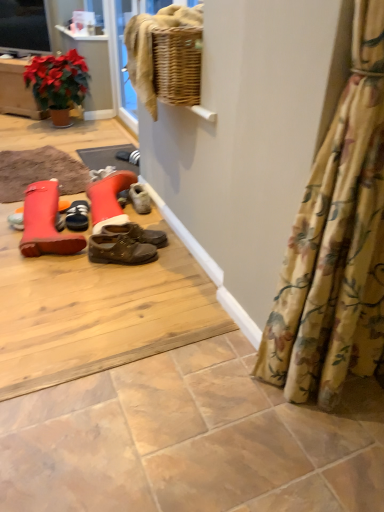
In order to face matte black television at upper left, should I rotate leftwards or rightwards?

Turn left approximately 22.263 degrees to face it.

This screenshot has width=384, height=512. In order to click on leather boot at left, which is the 1th footwear from front to back in this screenshot , I will do `click(45, 223)`.

This screenshot has height=512, width=384. Describe the element at coordinates (337, 243) in the screenshot. I see `floral fabric curtain at lower right` at that location.

What is the approximate height of black suede shoes at center, which is the 1th footwear in back-to-front order?

It is 7.74 centimeters.

Identify the location of matte black television at upper left. (24, 26).

Considering the sizes of leather boot at left, acting as the 2th footwear starting from the back, and black suede shoes at center, acting as the second footwear starting from the front, in the image, is leather boot at left, acting as the 2th footwear starting from the back, wider or thinner than black suede shoes at center, acting as the second footwear starting from the front,?

In the image, leather boot at left, acting as the 2th footwear starting from the back, appears to be wider than black suede shoes at center, acting as the second footwear starting from the front.

Which object is closer to the camera, leather boot at left, acting as the 2th footwear starting from the back, or black suede shoes at center, which is the 1th footwear in back-to-front order?

leather boot at left, acting as the 2th footwear starting from the back, is closer to the camera.

Is leather boot at left, acting as the 2th footwear starting from the back, inside the boundaries of black suede shoes at center, acting as the second footwear starting from the front, or outside?

The correct answer is: outside.

From the image's perspective, relative to black suede shoes at center, acting as the second footwear starting from the front, is leather boot at left, acting as the 2th footwear starting from the back, above or below?

Clearly, from the image's perspective, leather boot at left, acting as the 2th footwear starting from the back, is below black suede shoes at center, acting as the second footwear starting from the front.

Is black suede shoes at center, which is the 1th footwear in back-to-front order, surrounding leather boot at left, which is the 1th footwear from front to back?

That's incorrect, leather boot at left, which is the 1th footwear from front to back, is not inside black suede shoes at center, which is the 1th footwear in back-to-front order.

Is black suede shoes at center, acting as the second footwear starting from the front, bigger or smaller than leather boot at left, which is the 1th footwear from front to back?

In the image, black suede shoes at center, acting as the second footwear starting from the front, appears to be smaller than leather boot at left, which is the 1th footwear from front to back.

Is black suede shoes at center, acting as the second footwear starting from the front, next to leather boot at left, which is the 1th footwear from front to back?

black suede shoes at center, acting as the second footwear starting from the front, is not next to leather boot at left, which is the 1th footwear from front to back, and they're not touching.

Where is `footwear behind the leather boot at left, which is the 1th footwear from front to back`? The height and width of the screenshot is (512, 384). footwear behind the leather boot at left, which is the 1th footwear from front to back is located at coordinates (77, 216).

Which is closer, (25, 14) or (69, 220)?

Positioned in front is point (69, 220).

Who is smaller, matte black television at upper left or black suede shoes at center, acting as the second footwear starting from the front?

black suede shoes at center, acting as the second footwear starting from the front.

Between matte black television at upper left and black suede shoes at center, acting as the second footwear starting from the front, which one is positioned behind?

matte black television at upper left is further from the camera.

From the image's perspective, is matte black television at upper left located above or below black suede shoes at center, which is the 1th footwear in back-to-front order?

Clearly, from the image's perspective, matte black television at upper left is above black suede shoes at center, which is the 1th footwear in back-to-front order.

From a real-world perspective, which is physically above, leather boot at left, which is the 1th footwear from front to back, or matte black television at upper left?

matte black television at upper left.

Is leather boot at left, acting as the 2th footwear starting from the back, oriented away from matte black television at upper left?

That's not correct — leather boot at left, acting as the 2th footwear starting from the back, is not looking away from matte black television at upper left.

Based on their sizes in the image, would you say leather boot at left, which is the 1th footwear from front to back, is bigger or smaller than matte black television at upper left?

A: In the image, leather boot at left, which is the 1th footwear from front to back, appears to be smaller than matte black television at upper left.

Between point (57, 194) and point (284, 353), which one is positioned in front?

Point (284, 353)

In terms of width, does leather boot at left, which is the 1th footwear from front to back, look wider or thinner when compared to floral fabric curtain at lower right?

leather boot at left, which is the 1th footwear from front to back, is wider than floral fabric curtain at lower right.

Does leather boot at left, acting as the 2th footwear starting from the back, come in front of floral fabric curtain at lower right?

No.

From the image's perspective, is leather boot at left, acting as the 2th footwear starting from the back, located beneath floral fabric curtain at lower right?

Actually, leather boot at left, acting as the 2th footwear starting from the back, appears above floral fabric curtain at lower right in the image.

Does floral fabric curtain at lower right have a smaller size compared to matte black television at upper left?

Incorrect, floral fabric curtain at lower right is not smaller in size than matte black television at upper left.

Is point (334, 370) closer to viewer compared to point (38, 38)?

Yes, point (334, 370) is in front of point (38, 38).

In terms of width, does floral fabric curtain at lower right look wider or thinner when compared to matte black television at upper left?

In the image, floral fabric curtain at lower right appears to be wider than matte black television at upper left.

Does floral fabric curtain at lower right touch matte black television at upper left?

floral fabric curtain at lower right and matte black television at upper left are not in contact.

Considering the points (67, 217) and (12, 10), which point is behind, point (67, 217) or point (12, 10)?

The point (12, 10) is more distant.

In terms of height, does black suede shoes at center, acting as the second footwear starting from the front, look taller or shorter compared to matte black television at upper left?

black suede shoes at center, acting as the second footwear starting from the front, is shorter than matte black television at upper left.

How many degrees apart are the facing directions of black suede shoes at center, which is the 1th footwear in back-to-front order, and matte black television at upper left?

The angular difference between black suede shoes at center, which is the 1th footwear in back-to-front order, and matte black television at upper left is 56.9 degrees.

Is black suede shoes at center, which is the 1th footwear in back-to-front order, located outside matte black television at upper left?

black suede shoes at center, which is the 1th footwear in back-to-front order, lies outside matte black television at upper left's area.

Locate an element on the screen. Image resolution: width=384 pixels, height=512 pixels. footwear above the leather boot at left, acting as the 2th footwear starting from the back (from the image's perspective) is located at coordinates (77, 216).

The height and width of the screenshot is (512, 384). I want to click on footwear on the right of leather boot at left, acting as the 2th footwear starting from the back, so click(77, 216).

Looking at the image, which one is located further to matte black television at upper left, black suede shoes at center, which is the 1th footwear in back-to-front order, or floral fabric curtain at lower right?

floral fabric curtain at lower right lies further to matte black television at upper left than the other object.

Based on the photo, estimate the real-world distances between objects in this image. Which object is further from black suede shoes at center, which is the 1th footwear in back-to-front order, floral fabric curtain at lower right or leather boot at left, acting as the 2th footwear starting from the back?

floral fabric curtain at lower right lies further to black suede shoes at center, which is the 1th footwear in back-to-front order, than the other object.

Looking at the image, which one is located further to matte black television at upper left, leather boot at left, acting as the 2th footwear starting from the back, or black suede shoes at center, acting as the second footwear starting from the front?

leather boot at left, acting as the 2th footwear starting from the back, lies further to matte black television at upper left than the other object.

From the image, which object appears to be nearer to floral fabric curtain at lower right, black suede shoes at center, acting as the second footwear starting from the front, or matte black television at upper left?

black suede shoes at center, acting as the second footwear starting from the front, lies closer to floral fabric curtain at lower right than the other object.

Looking at the image, which one is located further to black suede shoes at center, acting as the second footwear starting from the front, leather boot at left, acting as the 2th footwear starting from the back, or floral fabric curtain at lower right?

Based on the image, floral fabric curtain at lower right appears to be further to black suede shoes at center, acting as the second footwear starting from the front.

Based on their spatial positions, is matte black television at upper left or floral fabric curtain at lower right closer to black suede shoes at center, acting as the second footwear starting from the front?

Based on the image, floral fabric curtain at lower right appears to be nearer to black suede shoes at center, acting as the second footwear starting from the front.

Based on their spatial positions, is black suede shoes at center, which is the 1th footwear in back-to-front order, or floral fabric curtain at lower right closer to leather boot at left, acting as the 2th footwear starting from the back?

black suede shoes at center, which is the 1th footwear in back-to-front order.

Based on their spatial positions, is leather boot at left, acting as the 2th footwear starting from the back, or floral fabric curtain at lower right closer to matte black television at upper left?

Answer: leather boot at left, acting as the 2th footwear starting from the back, lies closer to matte black television at upper left than the other object.

Find the location of a particular element. The width and height of the screenshot is (384, 512). footwear between floral fabric curtain at lower right and black suede shoes at center, which is the 1th footwear in back-to-front order, in the front-back direction is located at coordinates (45, 223).

Locate an element on the screen. The height and width of the screenshot is (512, 384). footwear between matte black television at upper left and leather boot at left, which is the 1th footwear from front to back, in the vertical direction is located at coordinates (77, 216).